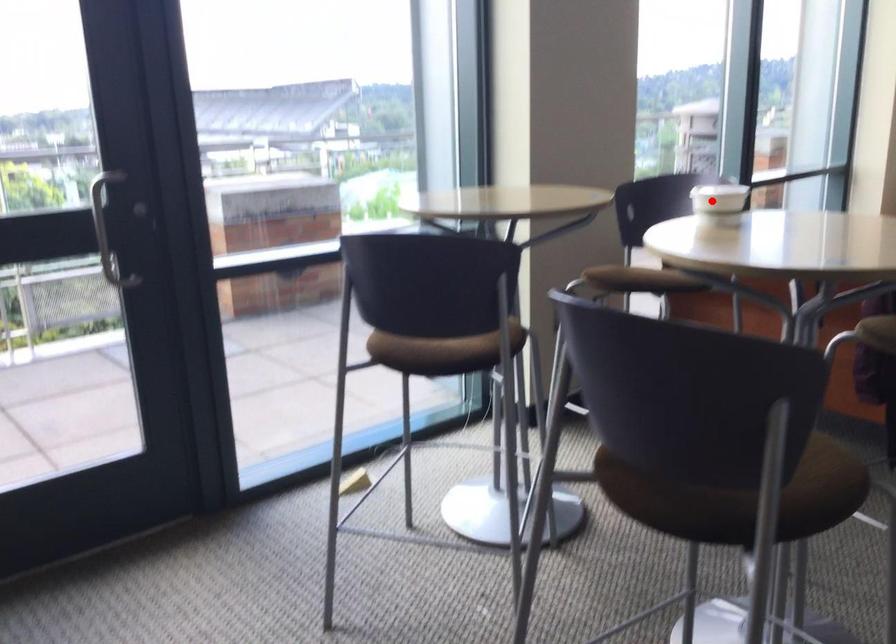
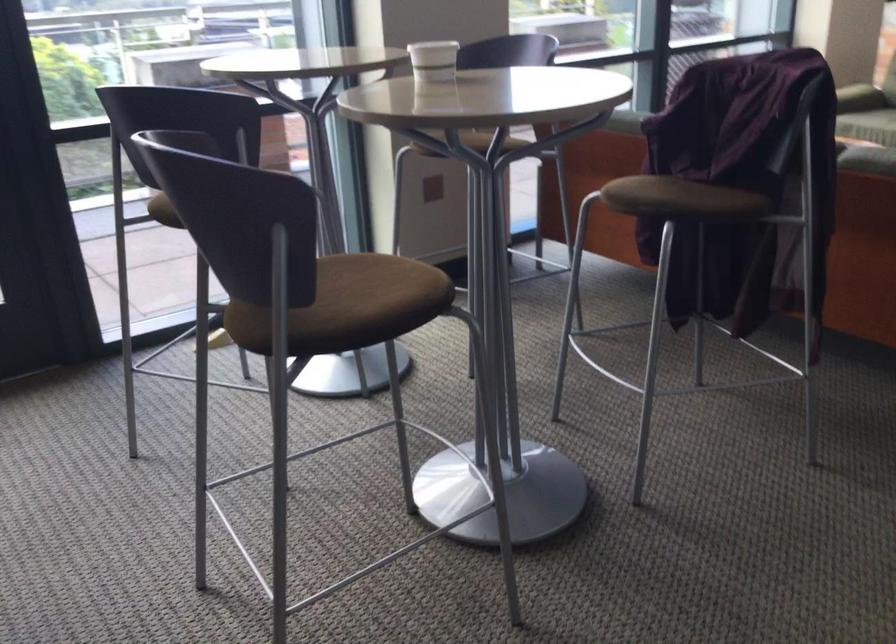
In the second image, find the point that corresponds to the highlighted location in the first image.

(433, 61)